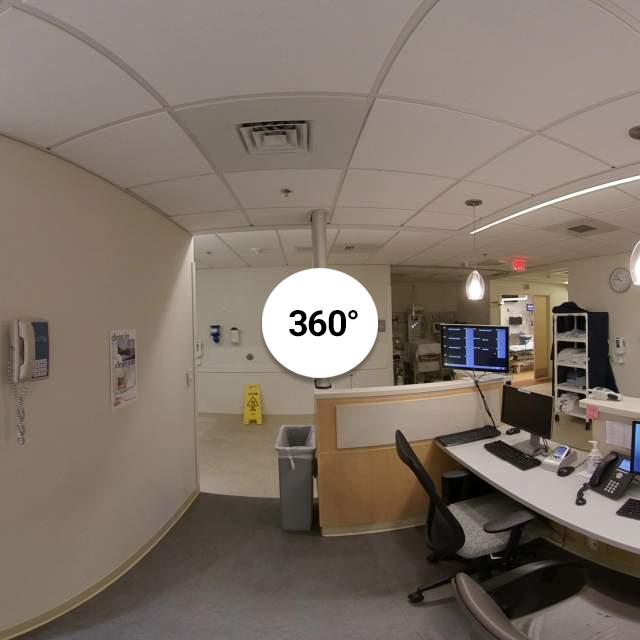
What are the coordinates of `ceiling tiles` in the screenshot? It's located at [216, 56], [434, 134], [515, 61], [394, 189].